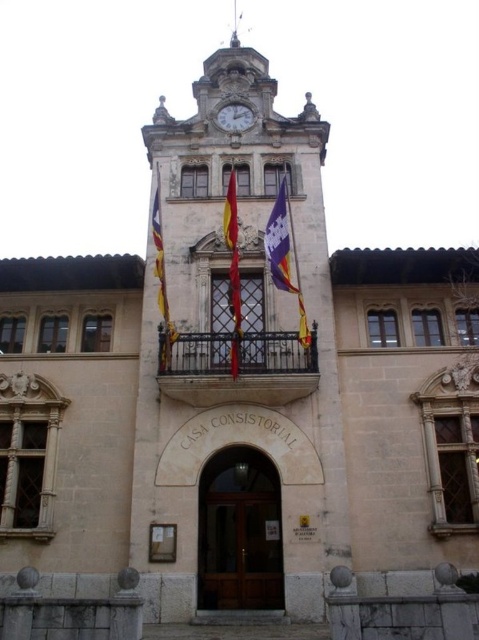
Question: Which point is closer to the camera taking this photo?

Choices:
 (A) (250, 83)
 (B) (237, 301)
 (C) (284, 278)
 (D) (243, 108)

Answer: (B)

Question: Which point appears closest to the camera in this image?

Choices:
 (A) tap(229, 292)
 (B) tap(156, 227)

Answer: (B)

Question: Is purple fabric flag at center positioned before matte yellow flag at center?

Choices:
 (A) yes
 (B) no

Answer: (B)

Question: Is black wrought iron balcony at center above white stone clock at upper center?

Choices:
 (A) yes
 (B) no

Answer: (B)

Question: Is the position of black wrought iron balcony at center less distant than that of matte yellow flag at center?

Choices:
 (A) no
 (B) yes

Answer: (B)

Question: Which is nearer to the white stone clock at upper center?

Choices:
 (A) brown wooden door at center
 (B) stone clock tower at center

Answer: (B)